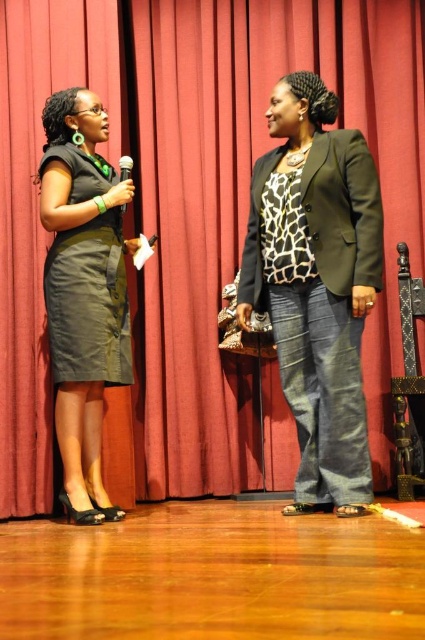
Question: Is wooden floor at lower center behind metallic silver microphone at center?

Choices:
 (A) no
 (B) yes

Answer: (A)

Question: Which is nearer to the metallic silver microphone at center?

Choices:
 (A) matte olive green skirt at left
 (B) matte green blazer at center
 (C) wooden floor at lower center

Answer: (A)

Question: Is matte green blazer at center bigger than matte black dress at left?

Choices:
 (A) yes
 (B) no

Answer: (B)

Question: Which object is the closest to the metallic silver microphone at center?

Choices:
 (A) matte olive green skirt at left
 (B) wooden floor at lower center

Answer: (A)

Question: Can you confirm if matte green blazer at center is smaller than metallic silver microphone at center?

Choices:
 (A) yes
 (B) no

Answer: (B)

Question: Considering the real-world distances, which object is farthest from the wooden floor at lower center?

Choices:
 (A) metallic silver microphone at center
 (B) matte black dress at left
 (C) matte olive green skirt at left
 (D) matte green blazer at center

Answer: (A)